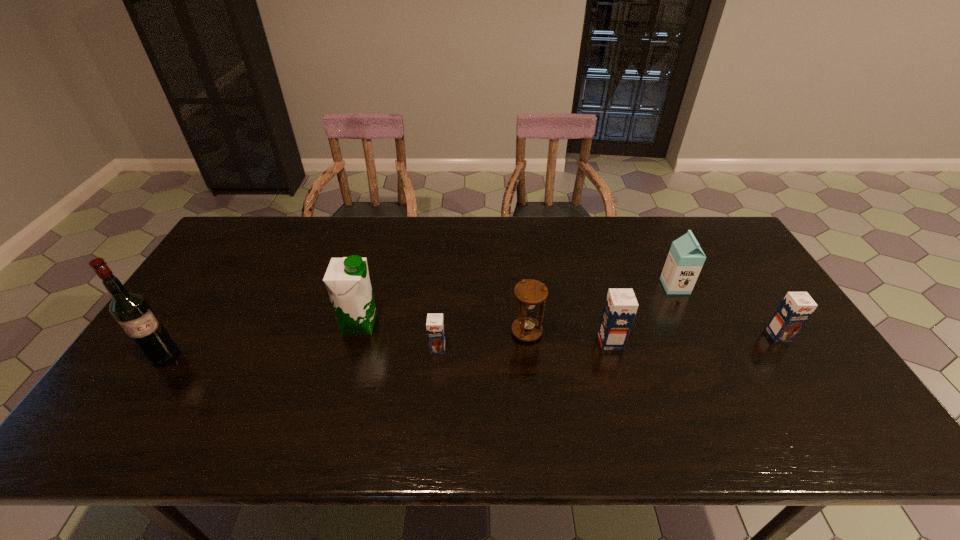
The height and width of the screenshot is (540, 960). I want to click on vacant place for an extra chocolate milk on the left, so click(260, 355).